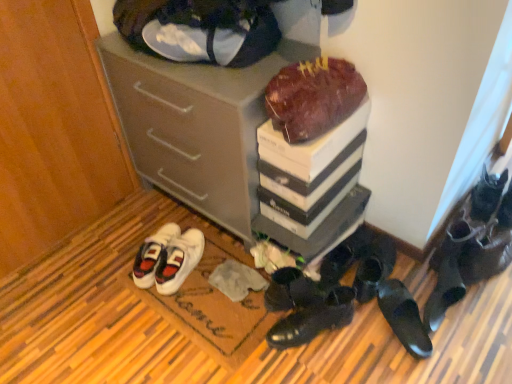
Identify the location of free space in front of black leather shoes at lower right, the 3th footwear viewed from the right. The image size is (512, 384). (466, 358).